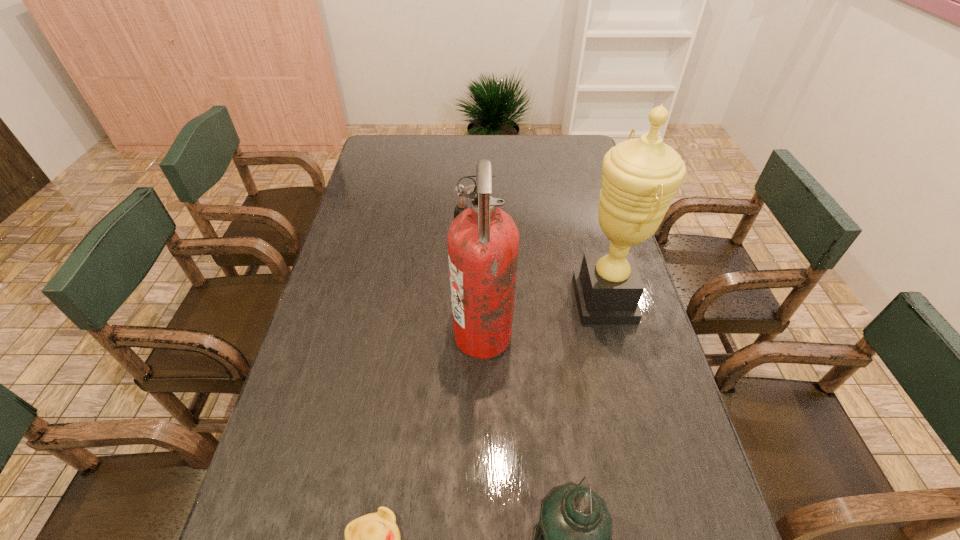
Where is `trophy cup`? The height and width of the screenshot is (540, 960). trophy cup is located at coordinates (640, 177).

Locate an element on the screen. This screenshot has width=960, height=540. fire extinguisher is located at coordinates click(483, 241).

Identify the location of free spot located at the front of the trophy cup with handles. (455, 301).

Identify the location of free spot located 0.150m at the front of the trophy cup with handles. This screenshot has height=540, width=960. (519, 301).

The image size is (960, 540). Find the location of `free space located 0.260m at the front of the trophy cup with handles`. free space located 0.260m at the front of the trophy cup with handles is located at coordinates (480, 301).

Identify the location of vacant space situated on the front of the fire extinguisher near the operation label. The image size is (960, 540). (423, 336).

What are the coordinates of `free space located 0.200m on the front of the fire extinguisher near the operation label` in the screenshot? It's located at (377, 336).

What are the coordinates of `vacant space located on the front of the fire extinguisher near the operation label` in the screenshot? It's located at (308, 336).

Where is `object located at the right edge`? The height and width of the screenshot is (540, 960). object located at the right edge is located at coordinates (640, 177).

In the image, there is a desktop. Where is `vacant space at the far edge`? vacant space at the far edge is located at coordinates (414, 146).